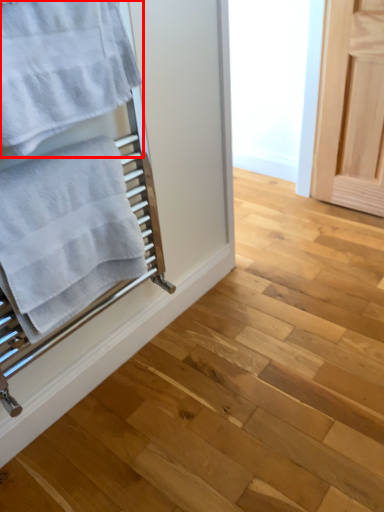
Question: From the image's perspective, what is the correct spatial positioning of towel (annotated by the red box) in reference to towel?

Choices:
 (A) above
 (B) below

Answer: (A)